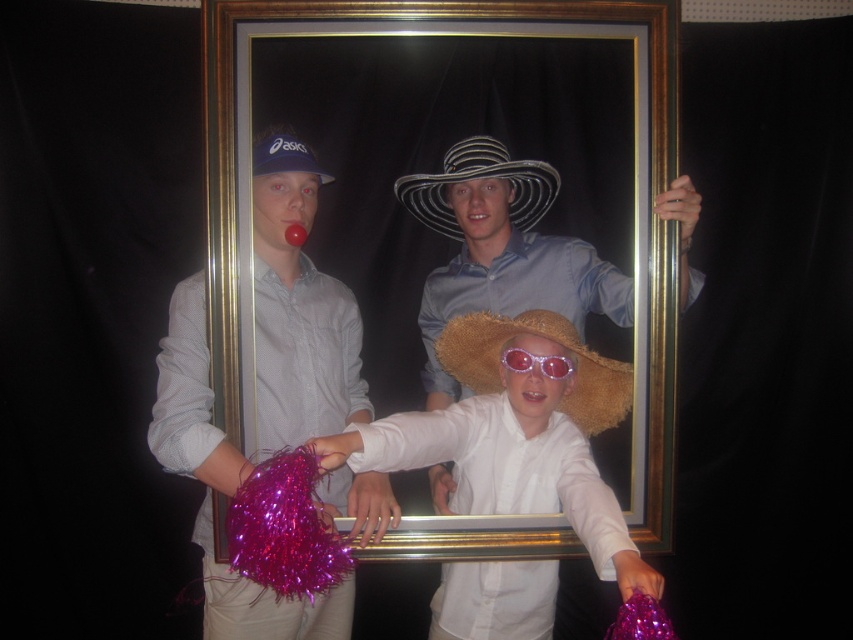
You are a photographer setting up a tripod to take a closeup shot of both the straw hat at center and the black and white striped cowboy hat at center. The tripod has a maximum reach of 9 centimeters. Can you fit both hats into the frame without moving the tripod?

The straw hat at center and the black and white striped cowboy hat at center are 8.81 centimeters apart from each other. Since the tripod can reach up to 9 centimeters, you can fit both hats into the frame without moving the tripod.